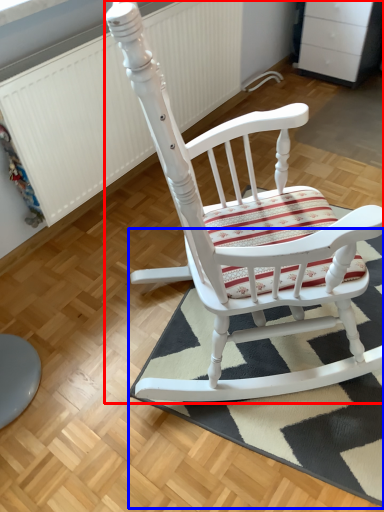
Question: Which of the following is the farthest to the observer, chair (highlighted by a red box) or doormat (highlighted by a blue box)?

Choices:
 (A) chair
 (B) doormat

Answer: (B)